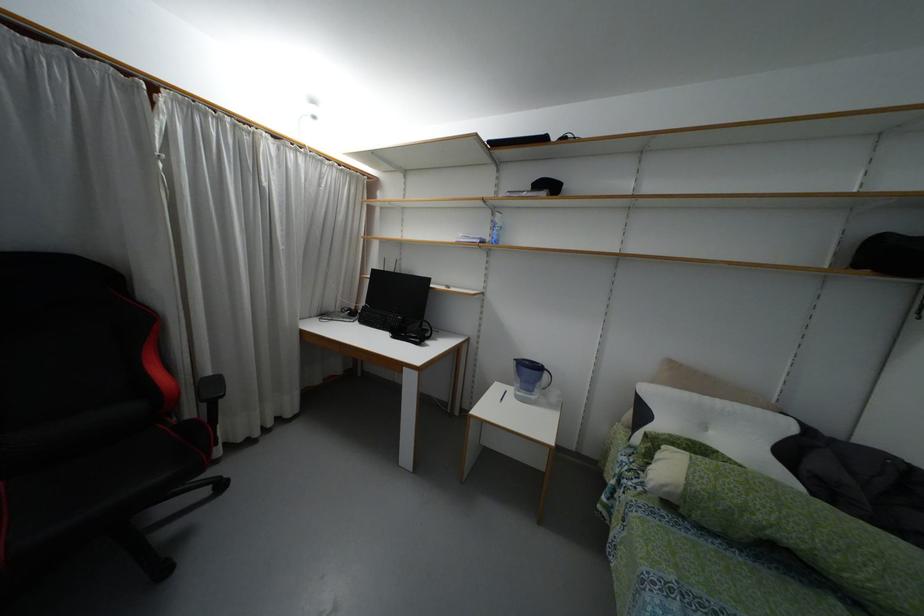
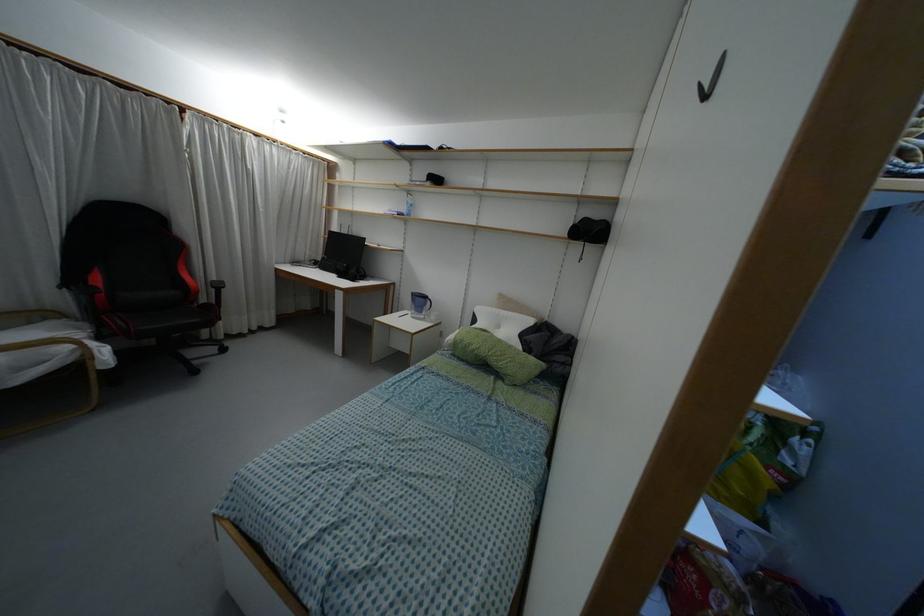
Where in the second image is the point corresponding to point 213,387 from the first image?

(217, 286)